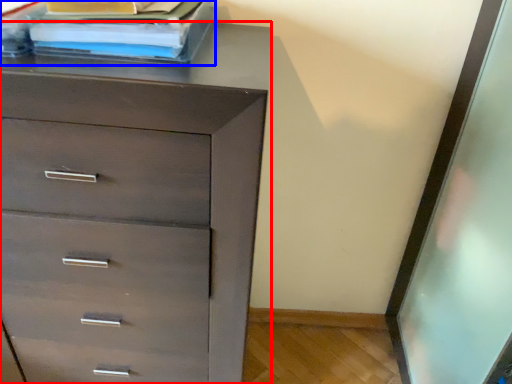
Question: Which object appears closest to the camera in this image, chest of drawers (highlighted by a red box) or book (highlighted by a blue box)?

Choices:
 (A) chest of drawers
 (B) book

Answer: (A)